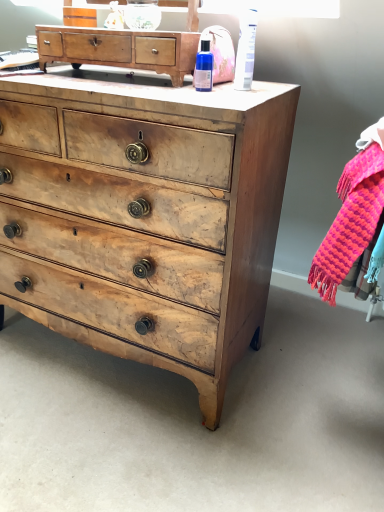
The image size is (384, 512). Identify the location of free space that is to the left of blue glass bottle at upper center, which ranks as the 1th toiletry in left-to-right order. (152, 84).